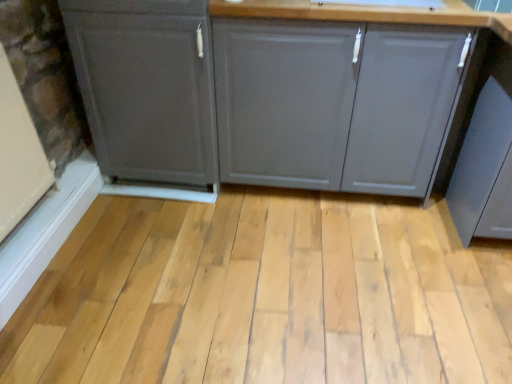
Question: Is natural wood plank at center at the left side of matte gray cabinet at center, positioned as the 1th cabinetry in right-to-left order?

Choices:
 (A) yes
 (B) no

Answer: (A)

Question: Can you confirm if natural wood plank at center is taller than matte gray cabinet at center, the 2th cabinetry positioned from the left?

Choices:
 (A) no
 (B) yes

Answer: (A)

Question: Does natural wood plank at center have a larger size compared to matte gray cabinet at center, the 2th cabinetry positioned from the left?

Choices:
 (A) no
 (B) yes

Answer: (A)

Question: Is natural wood plank at center wider than matte gray cabinet at center, positioned as the 1th cabinetry in right-to-left order?

Choices:
 (A) no
 (B) yes

Answer: (B)

Question: From the image's perspective, is natural wood plank at center on top of matte gray cabinet at center, positioned as the 1th cabinetry in right-to-left order?

Choices:
 (A) yes
 (B) no

Answer: (B)

Question: In terms of width, does natural wood plank at center look wider or thinner when compared to matte gray cabinet at center, positioned as the 1th cabinetry in right-to-left order?

Choices:
 (A) thin
 (B) wide

Answer: (B)

Question: From a real-world perspective, relative to matte gray cabinet at center, positioned as the 1th cabinetry in right-to-left order, is natural wood plank at center vertically above or below?

Choices:
 (A) above
 (B) below

Answer: (B)

Question: Considering the positions of natural wood plank at center and matte gray cabinet at center, positioned as the 1th cabinetry in right-to-left order, in the image, is natural wood plank at center taller or shorter than matte gray cabinet at center, positioned as the 1th cabinetry in right-to-left order,?

Choices:
 (A) short
 (B) tall

Answer: (A)

Question: Considering the relative positions of natural wood plank at center and matte gray cabinet at center, the 2th cabinetry positioned from the left, in the image provided, is natural wood plank at center to the left or to the right of matte gray cabinet at center, the 2th cabinetry positioned from the left,?

Choices:
 (A) right
 (B) left

Answer: (B)

Question: Based on their positions, is matte gray cabinet at center, the 2th cabinetry positioned from the left, located to the left or right of matte gray cabinet at left, the first cabinetry viewed from the left?

Choices:
 (A) left
 (B) right

Answer: (B)

Question: In the image, is matte gray cabinet at center, positioned as the 1th cabinetry in right-to-left order, positioned in front of or behind matte gray cabinet at left, the first cabinetry viewed from the left?

Choices:
 (A) front
 (B) behind

Answer: (A)

Question: Based on their sizes in the image, would you say matte gray cabinet at center, positioned as the 1th cabinetry in right-to-left order, is bigger or smaller than matte gray cabinet at left, which is counted as the second cabinetry, starting from the right?

Choices:
 (A) big
 (B) small

Answer: (A)

Question: From a real-world perspective, is matte gray cabinet at center, the 2th cabinetry positioned from the left, physically located above or below matte gray cabinet at left, which is counted as the second cabinetry, starting from the right?

Choices:
 (A) above
 (B) below

Answer: (B)

Question: Looking at their shapes, would you say natural wood plank at center is wider or thinner than matte gray cabinet at left, the first cabinetry viewed from the left?

Choices:
 (A) wide
 (B) thin

Answer: (A)

Question: From their relative heights in the image, would you say natural wood plank at center is taller or shorter than matte gray cabinet at left, which is counted as the second cabinetry, starting from the right?

Choices:
 (A) short
 (B) tall

Answer: (A)